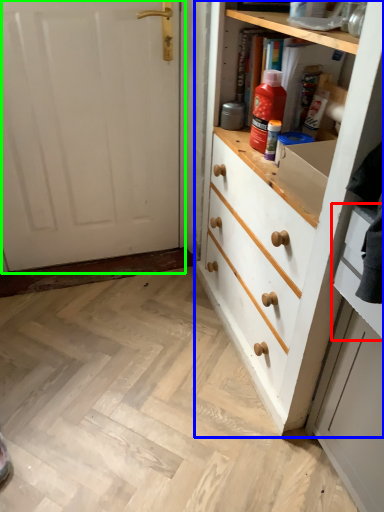
Question: Considering the real-world distances, which object is closest to drawer (highlighted by a red box)? chest of drawers (highlighted by a blue box) or door (highlighted by a green box).

Choices:
 (A) chest of drawers
 (B) door

Answer: (A)